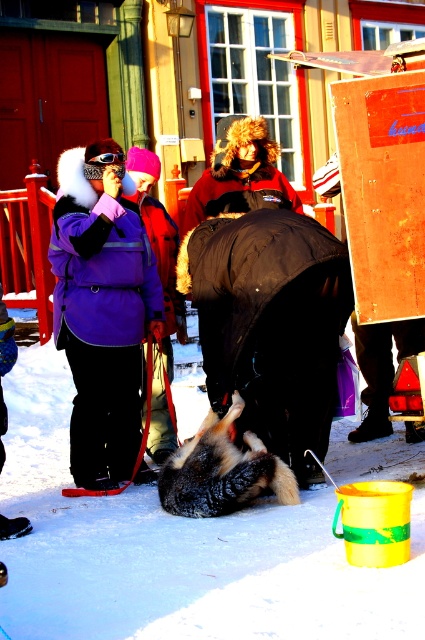
You are helping organize winter jackets in a store. You have two jackets to place on a shelf. The matte purple jacket at center and the purple fleece jacket at upper left. The shelf has a width of 1 meter. If you place both jackets side by side, will they fit? Explain your reasoning.

The matte purple jacket at center is wider than the purple fleece jacket at upper left. Since the shelf is 1 meter wide, and the total width of both jackets combined would exceed the shelf width, they will not fit side by side.

Based on the photo, you are an observer standing in the winter scene. You notice both the brown fur dog at center and the brown fur hat at center. Which object is smaller?

The brown fur dog at center is smaller than the brown fur hat at center.